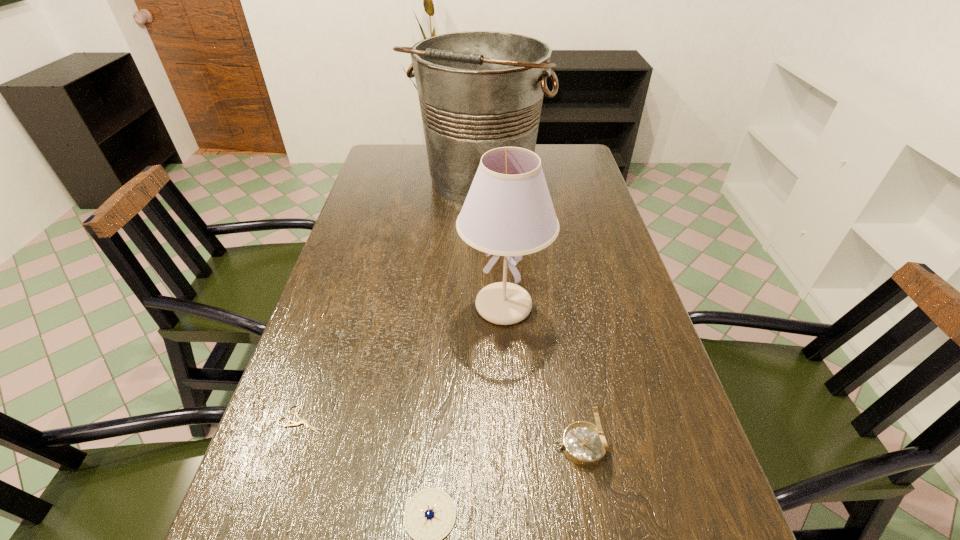
I want to click on object identified as the third closest to the shortest object, so click(x=585, y=444).

Identify which object is the fourth nearest to the tallest object. Please provide its 2D coordinates. Your answer should be formatted as a tuple, i.e. [(x, y)], where the tuple contains the x and y coordinates of a point satisfying the conditions above.

[(429, 516)]